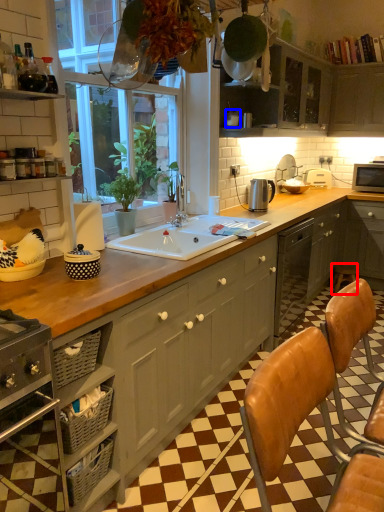
Question: Which object is further to the camera taking this photo, bar stool (highlighted by a red box) or appliance (highlighted by a blue box)?

Choices:
 (A) bar stool
 (B) appliance

Answer: (A)